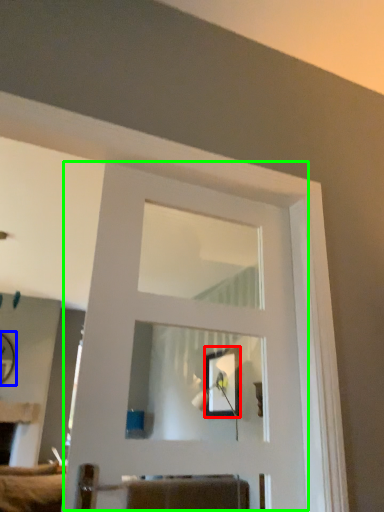
Question: Which object is positioned farthest from picture frame (highlighted by a red box)? Select from mirror (highlighted by a blue box) and door (highlighted by a green box).

Choices:
 (A) mirror
 (B) door

Answer: (A)